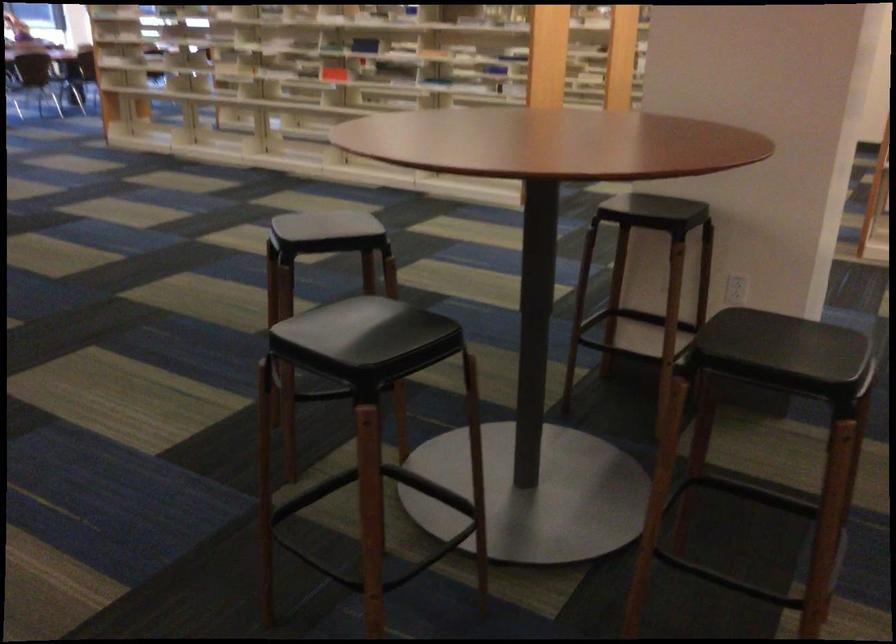
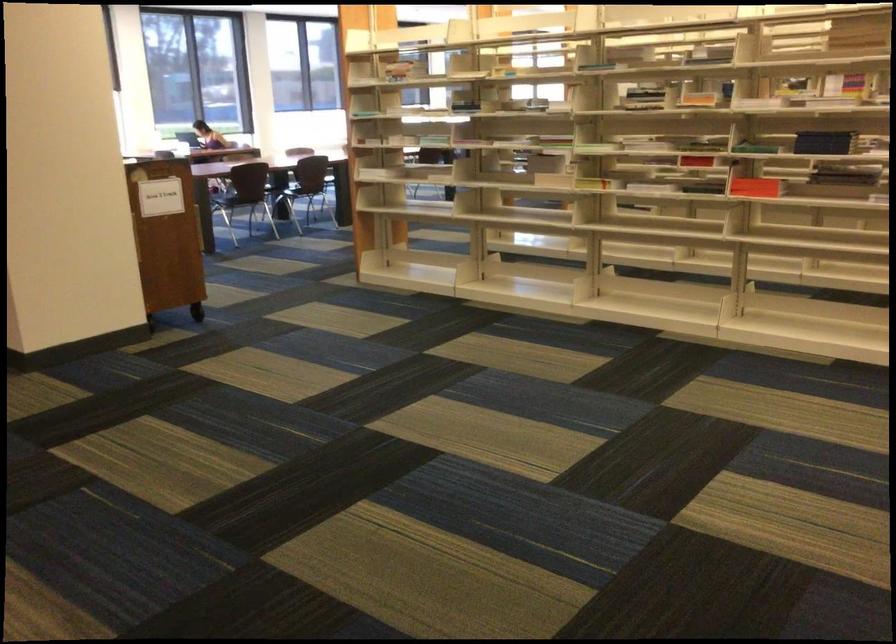
Which direction would the cameraman need to move to produce the second image?

The movement direction of the cameraman is left, forward.